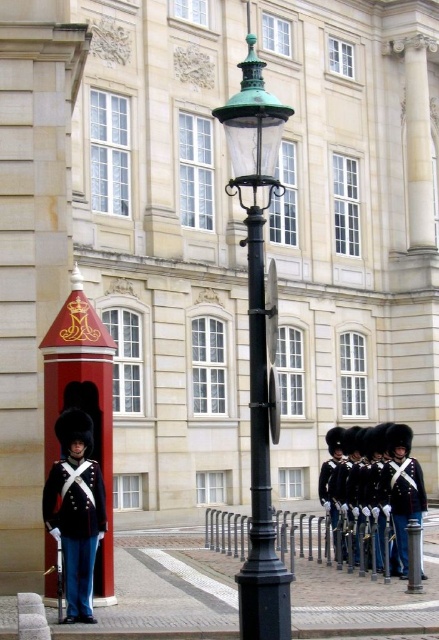
Between black glossy uniform at center and shiny black uniform at center, which one is positioned higher?

Positioned higher is black glossy uniform at center.

Describe the element at coordinates (377, 483) in the screenshot. I see `black glossy uniform at center` at that location.

The width and height of the screenshot is (439, 640). I want to click on black glossy uniform at center, so click(377, 483).

Does black metal pole at center appear on the right side of black glossy uniform at center?

In fact, black metal pole at center is to the left of black glossy uniform at center.

Who is positioned more to the right, black metal pole at center or black glossy uniform at center?

black glossy uniform at center

Who is more forward, (252, 225) or (399, 502)?

Positioned in front is point (252, 225).

I want to click on black metal pole at center, so click(261, 470).

Does point (223, 104) come behind point (338, 451)?

That is True.

Who is positioned more to the left, green glass lamp post at center or shiny black uniform at center?

green glass lamp post at center is more to the left.

What do you see at coordinates (259, 340) in the screenshot? The width and height of the screenshot is (439, 640). I see `green glass lamp post at center` at bounding box center [259, 340].

This screenshot has height=640, width=439. I want to click on green glass lamp post at center, so click(259, 340).